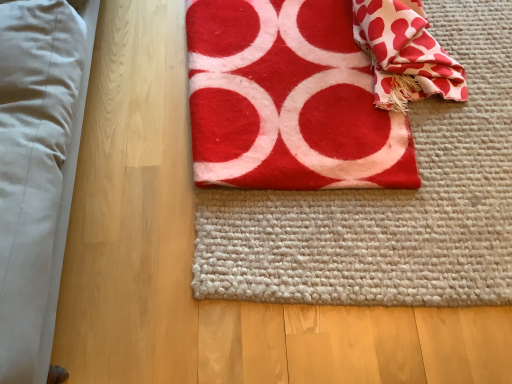
At what (x,y) coordinates should I click in order to perform the action: click on space that is in front of white textured fabric at upper right. Please return your answer as a coordinate pair (x, y). Looking at the image, I should click on (455, 160).